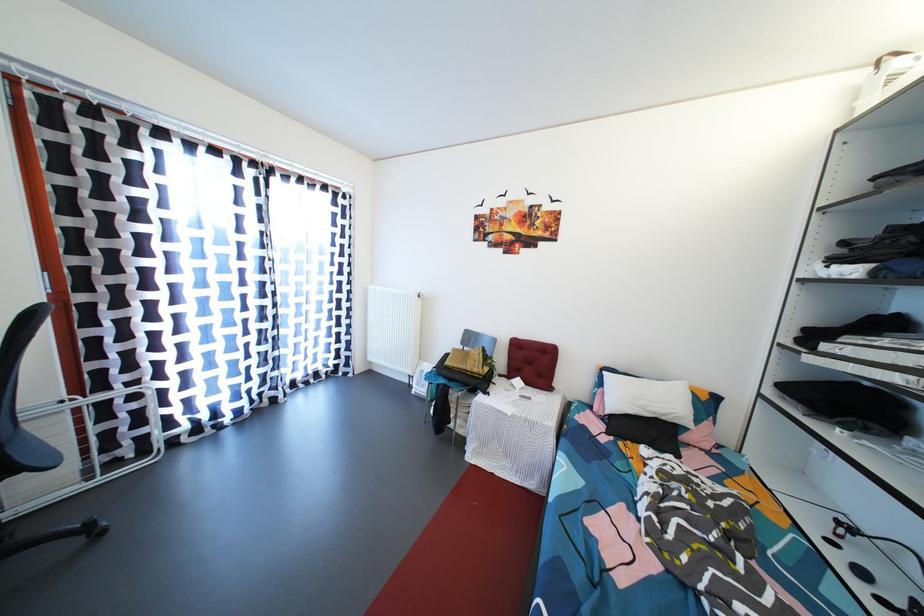
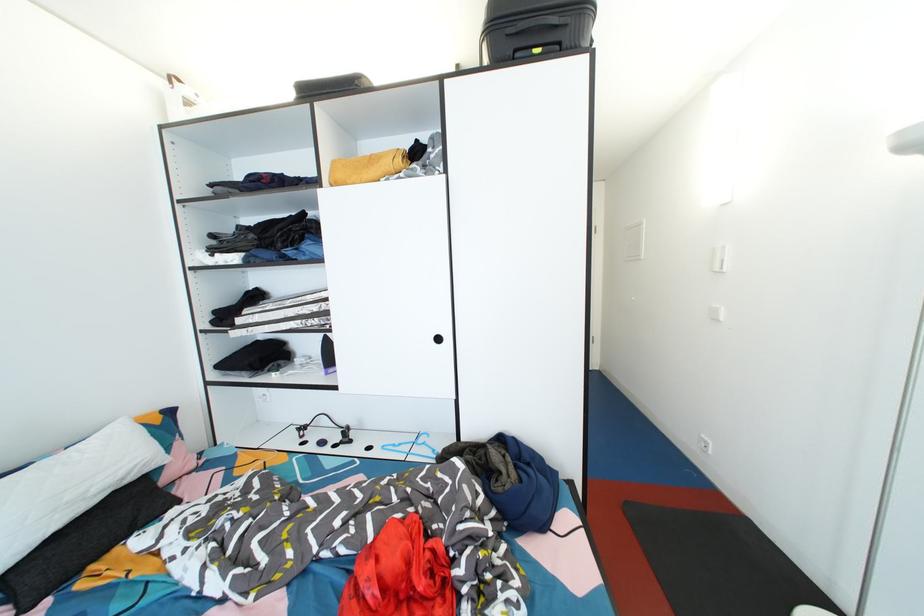
Where in the second image is the point corresponding to point (617, 421) from the first image?

(8, 583)